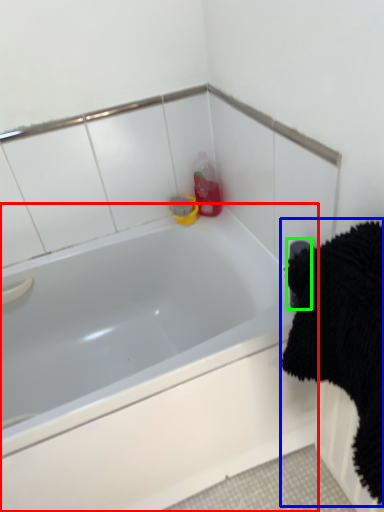
Question: Which object is positioned farthest from bathtub (highlighted by a red box)? Select from bath towel (highlighted by a blue box) and towel bar (highlighted by a green box).

Choices:
 (A) bath towel
 (B) towel bar

Answer: (B)